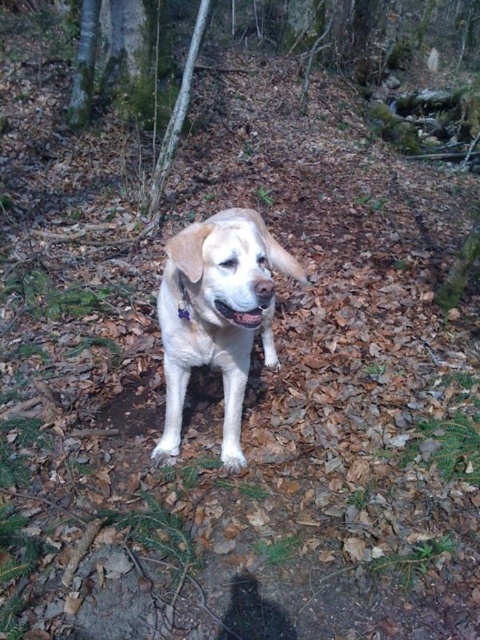
Between white fur dog at center and pink glossy tongue at center, which one appears on the right side from the viewer's perspective?

Positioned to the right is pink glossy tongue at center.

Is point (240, 212) behind point (240, 324)?

Yes, point (240, 212) is behind point (240, 324).

Find the location of a particular element. This screenshot has height=640, width=480. white fur dog at center is located at coordinates (216, 316).